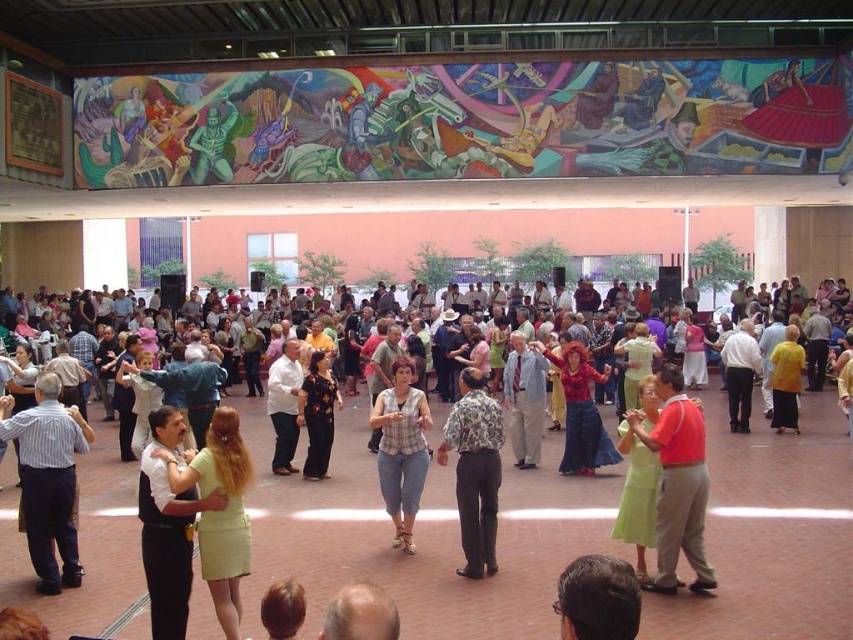
Question: From the image, what is the correct spatial relationship of light brown hair at lower center in relation to light blue shirt at center?

Choices:
 (A) left
 (B) right

Answer: (A)

Question: Does floral shirt at center have a smaller size compared to shiny red blouse at center?

Choices:
 (A) no
 (B) yes

Answer: (B)

Question: Based on their relative distances, which object is farther from the light blue shirt at center?

Choices:
 (A) floral dress at center
 (B) white shirt at center
 (C) floral print dress at center
 (D) plaid shirt at center

Answer: (B)

Question: Which point is closer to the camera?

Choices:
 (A) (289, 454)
 (B) (798, 362)

Answer: (A)

Question: Which of the following is the closest to the observer?

Choices:
 (A) light blue shirt at center
 (B) floral print dress at center
 (C) white shirt at center

Answer: (B)

Question: Is striped cotton shirt at lower left to the right of shiny red blouse at center from the viewer's perspective?

Choices:
 (A) no
 (B) yes

Answer: (A)